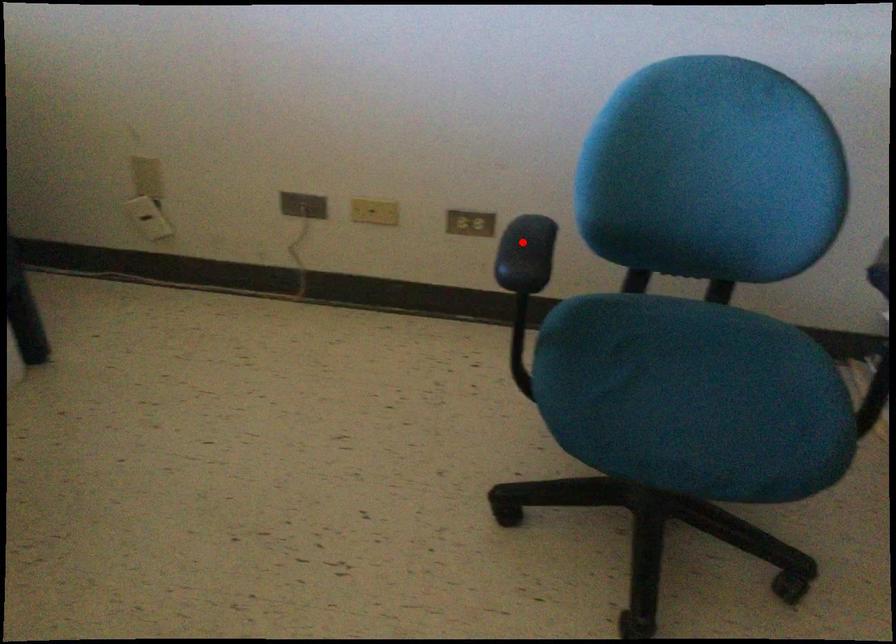
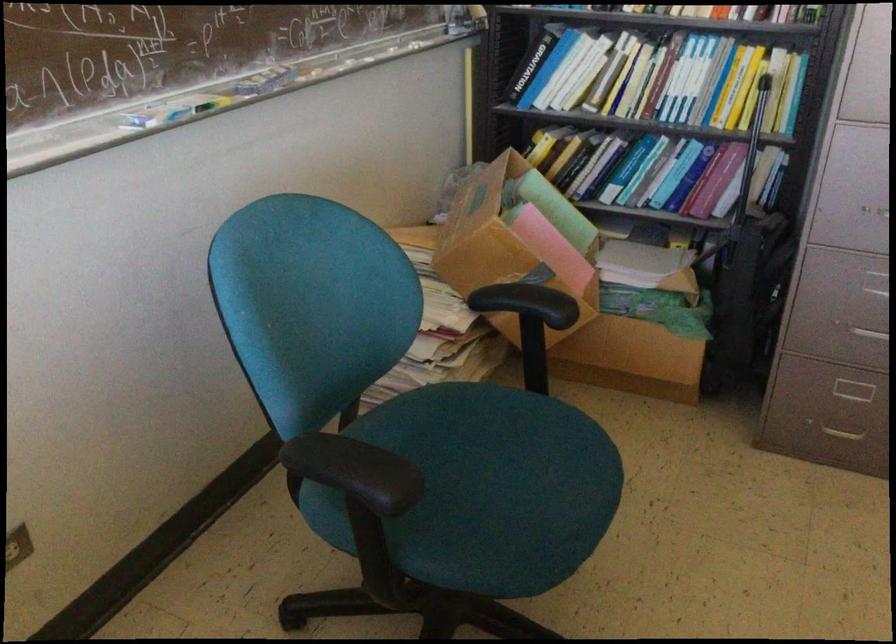
Where in the second image is the point corresponding to the highlighted location from the first image?

(356, 471)